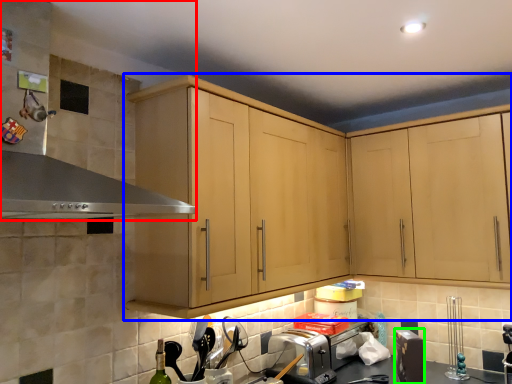
Question: Based on their relative distances, which object is farther from exhaust hood (highlighted by a red box)? Choose from cabinetry (highlighted by a blue box) and appliance (highlighted by a green box).

Choices:
 (A) cabinetry
 (B) appliance

Answer: (B)